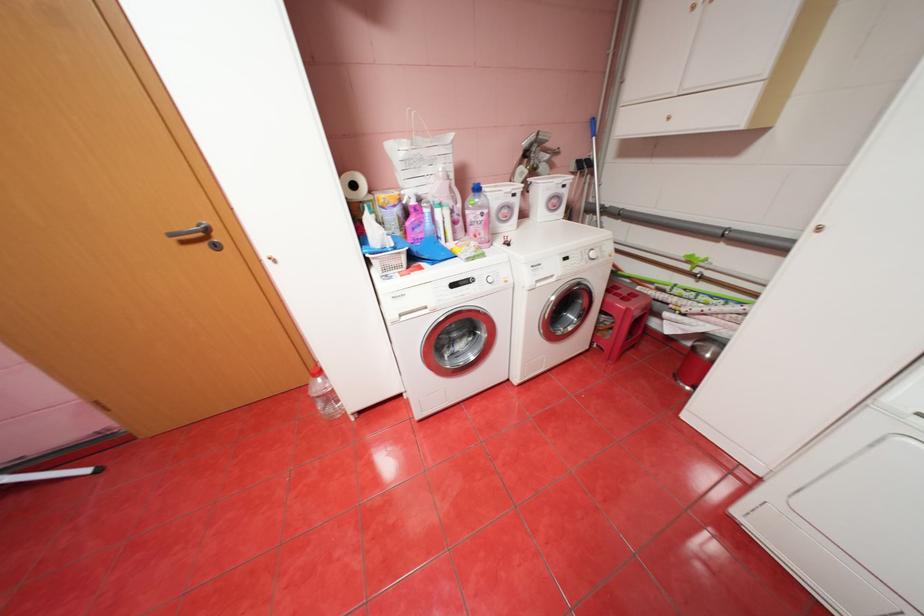
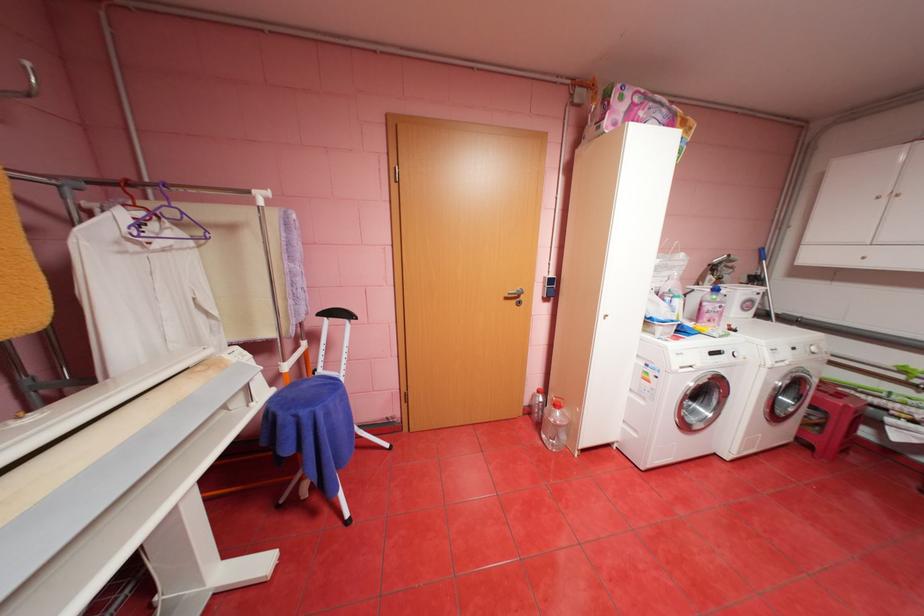
In the second image, find the point that corresponds to point (476, 281) in the first image.

(728, 352)